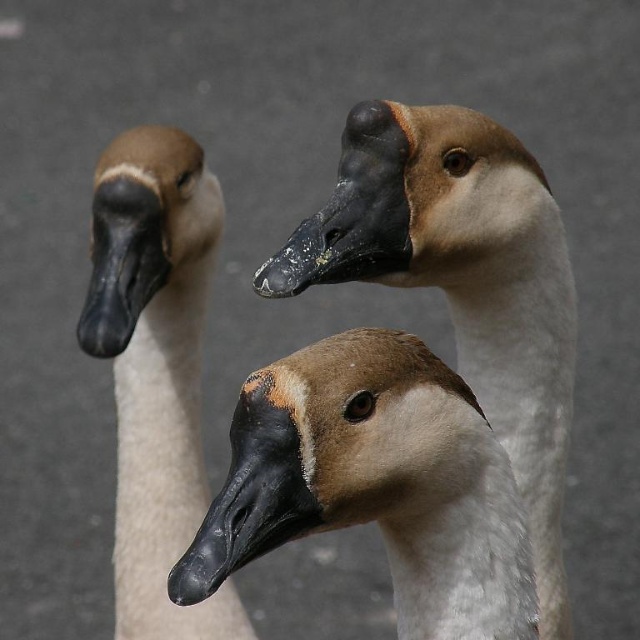
Does brown matte goose head at center come in front of matte black goose head at left?

That is True.

Can you confirm if brown matte goose head at center is smaller than matte black goose head at left?

Yes, brown matte goose head at center is smaller than matte black goose head at left.

Which is in front, point (364, 132) or point (113, 340)?

Point (364, 132)

Image resolution: width=640 pixels, height=640 pixels. I want to click on brown matte goose head at center, so click(420, 205).

Is matte brown goose at left below brown matte goose head at center?

Correct, matte brown goose at left is located below brown matte goose head at center.

Who is shorter, matte brown goose at left or brown matte goose head at center?

With less height is brown matte goose head at center.

Does point (180, 388) lie in front of point (486, 120)?

No.

This screenshot has height=640, width=640. I want to click on matte brown goose at left, so click(156, 369).

Can you confirm if matte brown goose at center is shorter than matte brown goose at left?

Yes, matte brown goose at center is shorter than matte brown goose at left.

Can you confirm if matte brown goose at center is smaller than matte brown goose at left?

No.

The width and height of the screenshot is (640, 640). Describe the element at coordinates (461, 280) in the screenshot. I see `matte brown goose at center` at that location.

Identify the location of matte brown goose at center. This screenshot has width=640, height=640. (461, 280).